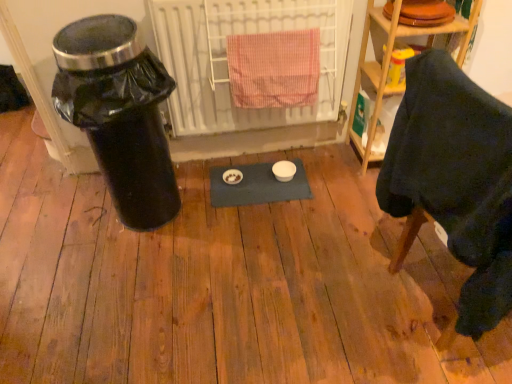
Question: From a real-world perspective, is pink checkered towel at center positioned above or below white metal radiator at center?

Choices:
 (A) below
 (B) above

Answer: (B)

Question: Is pink checkered towel at center taller or shorter than white metal radiator at center?

Choices:
 (A) tall
 (B) short

Answer: (B)

Question: Which is nearer to the wooden shelf at upper right?

Choices:
 (A) black plastic trash can at left
 (B) dark fabric chair at lower right
 (C) pink checkered towel at center
 (D) white metal radiator at center

Answer: (C)

Question: Considering the real-world distances, which object is farthest from the white metal radiator at center?

Choices:
 (A) dark fabric chair at lower right
 (B) wooden shelf at upper right
 (C) black plastic trash can at left
 (D) pink checkered towel at center

Answer: (A)